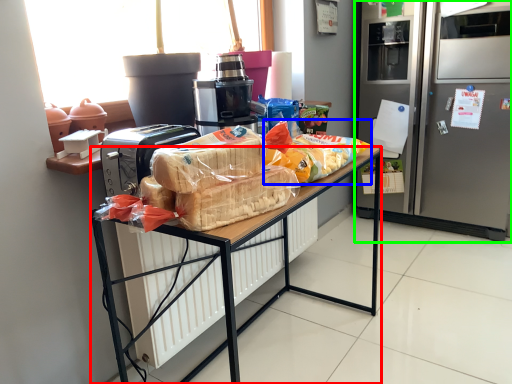
Question: Considering the real-world distances, which object is farthest from desk (highlighted by a red box)? snack (highlighted by a blue box) or refrigerator (highlighted by a green box)?

Choices:
 (A) snack
 (B) refrigerator

Answer: (B)